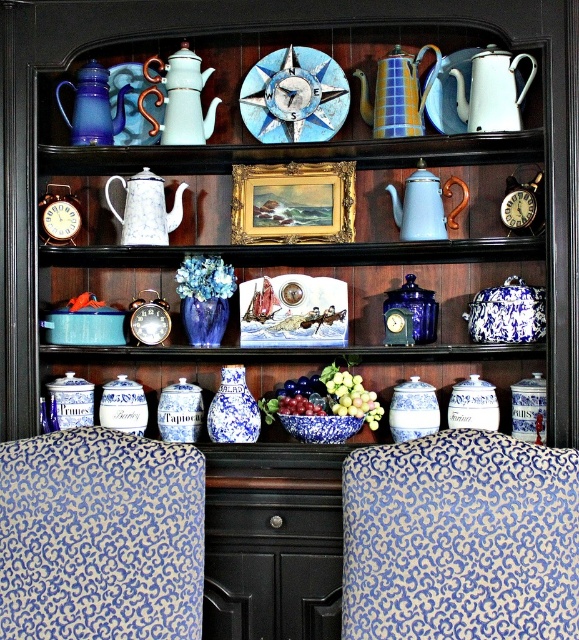
You are a delivery person who needs to place a new decorative item between the blue and yellow ceramic teapot at upper center and the blue porcelain vase at center. The item is 15 inches long. Can you fit it between them?

The blue and yellow ceramic teapot at upper center and the blue porcelain vase at center are 33.24 inches apart. Since the new item is 15 inches long, it can fit between them as there is enough space.